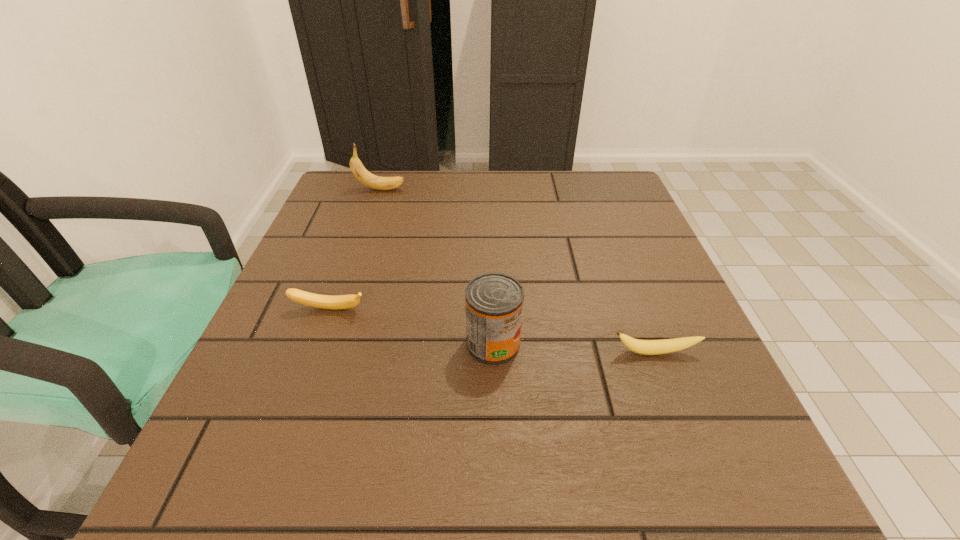
In order to click on the farthest banana in this screenshot , I will do `click(360, 172)`.

Identify the location of the farthest object. The width and height of the screenshot is (960, 540). (360, 172).

The height and width of the screenshot is (540, 960). I want to click on can, so click(x=494, y=302).

Where is `the second farthest banana`? the second farthest banana is located at coordinates (306, 298).

Find the location of `the rightmost banana`. the rightmost banana is located at coordinates (645, 347).

Find the location of a particular element. the nearest banana is located at coordinates (645, 347).

Where is `blank space located at the start of the peel on the tallest banana`? blank space located at the start of the peel on the tallest banana is located at coordinates (481, 189).

Where is `free space located on the back of the can`? The width and height of the screenshot is (960, 540). free space located on the back of the can is located at coordinates (491, 259).

Where is `vacant region located 0.130m at the stem of the second nearest banana`? This screenshot has height=540, width=960. vacant region located 0.130m at the stem of the second nearest banana is located at coordinates (307, 372).

Where is `vacant area situated 0.220m on the upward curve of the rightmost object`? vacant area situated 0.220m on the upward curve of the rightmost object is located at coordinates (707, 489).